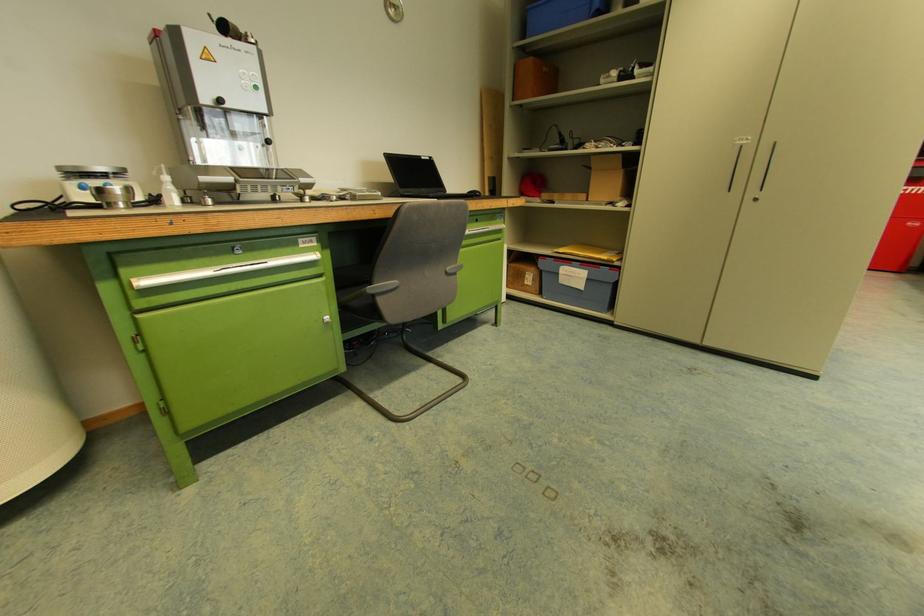
Identify the location of cabinet door lock. (138, 342).